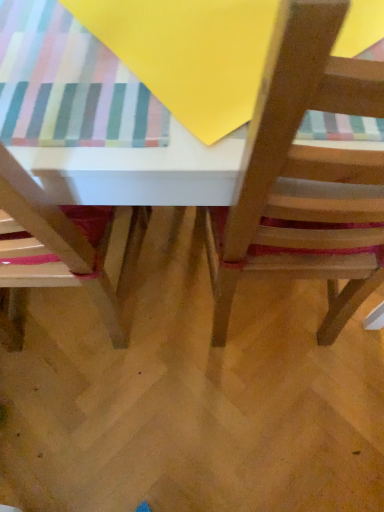
At what (x,y) coordinates should I click in order to perform the action: click on vacant space to the right of wooden chair at lower left, which appears as the 1th chair when viewed from the left. Please return your answer as a coordinate pair (x, y). This screenshot has height=512, width=384. Looking at the image, I should click on (172, 315).